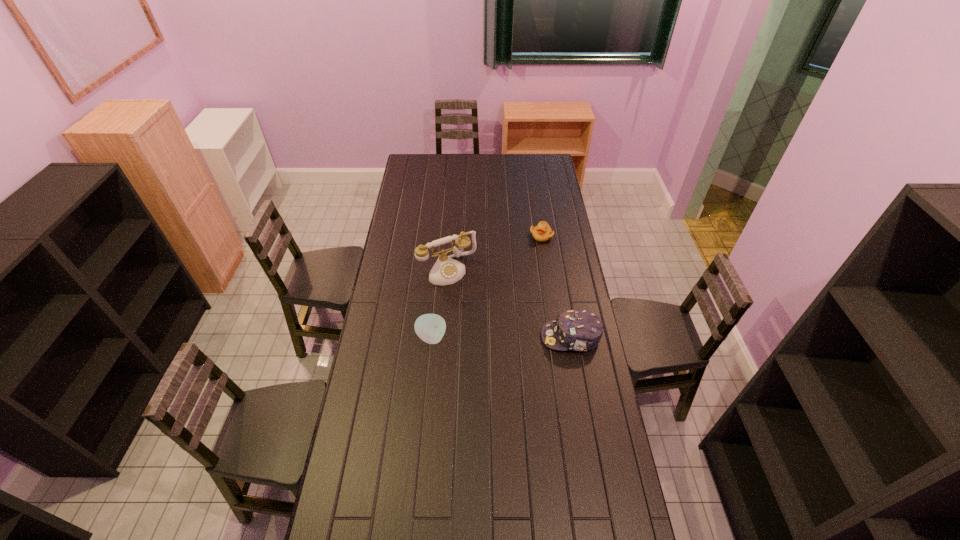
In order to click on unoccupied position between the second farthest object and the duckling in this screenshot , I will do `click(494, 253)`.

This screenshot has height=540, width=960. What are the coordinates of `free point between the duckling and the apple` in the screenshot? It's located at (487, 287).

This screenshot has width=960, height=540. What are the coordinates of `object that ranks as the third closest to the third nearest object` in the screenshot? It's located at (578, 330).

The width and height of the screenshot is (960, 540). What are the coordinates of `object that can be found as the closest to the apple` in the screenshot? It's located at (446, 270).

Find the location of `free space that satisfies the following two spatial constraints: 1. on the back side of the shortest object; 2. on the right side of the telephone`. free space that satisfies the following two spatial constraints: 1. on the back side of the shortest object; 2. on the right side of the telephone is located at coordinates (450, 236).

Identify the location of vacant space that satisfies the following two spatial constraints: 1. on the back side of the headwear; 2. on the front-facing side of the apple. The image size is (960, 540). (431, 337).

The height and width of the screenshot is (540, 960). What are the coordinates of `free space that satisfies the following two spatial constraints: 1. on the front side of the second farthest object; 2. on the front-facing side of the headwear` in the screenshot? It's located at (443, 337).

Where is `vacant region that satisfies the following two spatial constraints: 1. on the front side of the telephone; 2. on the front-facing side of the headwear`? This screenshot has width=960, height=540. vacant region that satisfies the following two spatial constraints: 1. on the front side of the telephone; 2. on the front-facing side of the headwear is located at coordinates (443, 337).